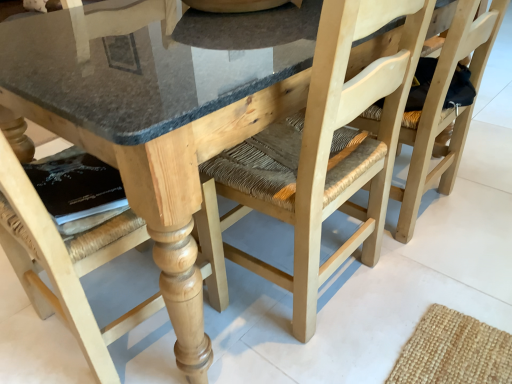
Question: Is natural wood chair at lower left, placed as the first chair when sorted from left to right, thinner than natural wood chair at center, positioned as the third chair in left-to-right order?

Choices:
 (A) no
 (B) yes

Answer: (A)

Question: Could natural wood chair at center, the first chair positioned from the right, be considered to be inside natural wood chair at lower left, the 3th chair in the right-to-left sequence?

Choices:
 (A) no
 (B) yes

Answer: (A)

Question: From the image's perspective, is natural wood chair at lower left, placed as the first chair when sorted from left to right, below natural wood chair at center, the first chair positioned from the right?

Choices:
 (A) no
 (B) yes

Answer: (B)

Question: From a real-world perspective, is natural wood chair at lower left, the 3th chair in the right-to-left sequence, positioned under natural wood chair at center, positioned as the third chair in left-to-right order, based on gravity?

Choices:
 (A) no
 (B) yes

Answer: (A)

Question: Considering the relative positions of natural wood chair at lower left, the 3th chair in the right-to-left sequence, and natural wood chair at center, positioned as the third chair in left-to-right order, in the image provided, is natural wood chair at lower left, the 3th chair in the right-to-left sequence, in front of natural wood chair at center, positioned as the third chair in left-to-right order,?

Choices:
 (A) no
 (B) yes

Answer: (B)

Question: In the image, is natural wood chair at center, the first chair positioned from the right, on the left side or the right side of natural wood chair at center, acting as the 2th chair starting from the right?

Choices:
 (A) left
 (B) right

Answer: (B)

Question: Is natural wood chair at center, the first chair positioned from the right, wider or thinner than natural wood chair at center, acting as the 2th chair starting from the right?

Choices:
 (A) thin
 (B) wide

Answer: (A)

Question: Is natural wood chair at center, the first chair positioned from the right, in front of or behind natural wood chair at center, acting as the 2th chair starting from the right, in the image?

Choices:
 (A) behind
 (B) front

Answer: (A)

Question: Which is correct: natural wood chair at center, the first chair positioned from the right, is inside natural wood chair at center, acting as the 2th chair starting from the right, or outside of it?

Choices:
 (A) inside
 (B) outside

Answer: (B)

Question: Considering the positions of natural wood chair at center, acting as the 2th chair starting from the right, and natural wood chair at lower left, the 3th chair in the right-to-left sequence, in the image, is natural wood chair at center, acting as the 2th chair starting from the right, wider or thinner than natural wood chair at lower left, the 3th chair in the right-to-left sequence,?

Choices:
 (A) thin
 (B) wide

Answer: (B)

Question: From the image's perspective, relative to natural wood chair at lower left, the 3th chair in the right-to-left sequence, is natural wood chair at center, acting as the 2th chair starting from the right, above or below?

Choices:
 (A) below
 (B) above

Answer: (B)

Question: Considering the relative positions of natural wood chair at center, acting as the 2th chair starting from the right, and natural wood chair at lower left, placed as the first chair when sorted from left to right, in the image provided, is natural wood chair at center, acting as the 2th chair starting from the right, to the left or to the right of natural wood chair at lower left, placed as the first chair when sorted from left to right,?

Choices:
 (A) left
 (B) right

Answer: (B)

Question: Is natural wood chair at center, acting as the 2th chair starting from the right, taller or shorter than natural wood chair at lower left, the 3th chair in the right-to-left sequence?

Choices:
 (A) tall
 (B) short

Answer: (B)

Question: Considering the positions of natural wood chair at lower left, placed as the first chair when sorted from left to right, and natural wood chair at center, the first chair positioned from the right, in the image, is natural wood chair at lower left, placed as the first chair when sorted from left to right, taller or shorter than natural wood chair at center, the first chair positioned from the right,?

Choices:
 (A) short
 (B) tall

Answer: (B)

Question: From the image's perspective, relative to natural wood chair at center, the first chair positioned from the right, is natural wood chair at lower left, the 3th chair in the right-to-left sequence, above or below?

Choices:
 (A) above
 (B) below

Answer: (B)